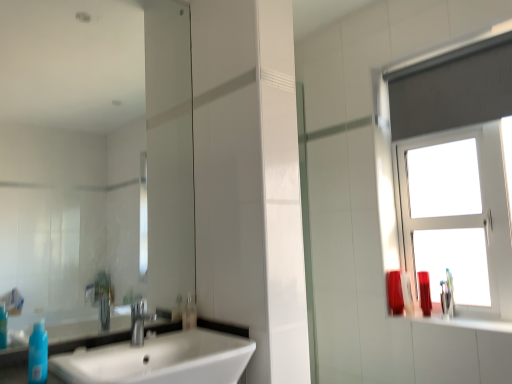
Question: Is matte red vase at right, which ranks as the fourth toiletry in front-to-back order, at the left side of white glossy sink at lower left?

Choices:
 (A) yes
 (B) no

Answer: (B)

Question: Is matte red vase at right, the second toiletry when ordered from left to right, far from white glossy sink at lower left?

Choices:
 (A) no
 (B) yes

Answer: (B)

Question: From a real-world perspective, is matte red vase at right, which ranks as the fourth toiletry in front-to-back order, positioned under white glossy sink at lower left based on gravity?

Choices:
 (A) no
 (B) yes

Answer: (A)

Question: Would you say matte red vase at right, which ranks as the fourth toiletry in front-to-back order, contains white glossy sink at lower left?

Choices:
 (A) no
 (B) yes

Answer: (A)

Question: Is matte red vase at right, which is counted as the 1th toiletry, starting from the back, facing towards white glossy sink at lower left?

Choices:
 (A) no
 (B) yes

Answer: (A)

Question: Does matte red vase at right, which is counted as the 1th toiletry, starting from the back, have a greater width compared to white glossy sink at lower left?

Choices:
 (A) no
 (B) yes

Answer: (A)

Question: Is silver metallic faucet at center at the back of shiny plastic bottle at right, which is the 4th toiletry in left-to-right order?

Choices:
 (A) yes
 (B) no

Answer: (B)

Question: From the image's perspective, is shiny plastic bottle at right, placed as the 3th toiletry when sorted from back to front, below silver metallic faucet at center?

Choices:
 (A) no
 (B) yes

Answer: (B)

Question: Are shiny plastic bottle at right, the second toiletry in the front-to-back sequence, and silver metallic faucet at center beside each other?

Choices:
 (A) yes
 (B) no

Answer: (B)

Question: Does shiny plastic bottle at right, placed as the 3th toiletry when sorted from back to front, come behind silver metallic faucet at center?

Choices:
 (A) yes
 (B) no

Answer: (A)

Question: Considering the relative sizes of shiny plastic bottle at right, the 1th toiletry in the right-to-left sequence, and silver metallic faucet at center in the image provided, is shiny plastic bottle at right, the 1th toiletry in the right-to-left sequence, shorter than silver metallic faucet at center?

Choices:
 (A) yes
 (B) no

Answer: (B)

Question: Is shiny plastic bottle at right, placed as the 3th toiletry when sorted from back to front, outside of silver metallic faucet at center?

Choices:
 (A) yes
 (B) no

Answer: (A)

Question: Does white glass window at upper right have a greater width compared to matte plastic container at right, which is counted as the third toiletry, starting from the left?

Choices:
 (A) no
 (B) yes

Answer: (B)